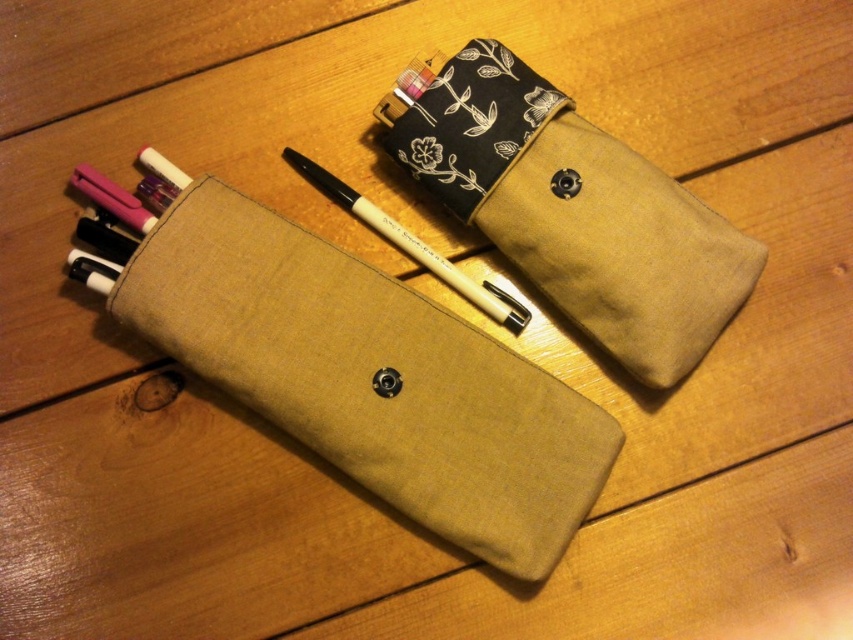
Is the position of canvas pouch at upper center more distant than that of white matte pen at center?

That is False.

Where is `canvas pouch at upper center`? The height and width of the screenshot is (640, 853). canvas pouch at upper center is located at coordinates (573, 211).

Who is more forward, [538,250] or [314,163]?

Point [538,250]

Where is `canvas pouch at upper center`? The width and height of the screenshot is (853, 640). canvas pouch at upper center is located at coordinates (573, 211).

Is point (502, 467) less distant than point (646, 234)?

No, it is behind (646, 234).

Locate an element on the screen. The image size is (853, 640). canvas pouch at center is located at coordinates (370, 378).

Which is more to the left, canvas pouch at center or white matte pen at center?

canvas pouch at center

Is canvas pouch at center above white matte pen at center?

No.

Is point (500, 561) closer to camera compared to point (299, 170)?

Yes, it is.

This screenshot has height=640, width=853. I want to click on canvas pouch at center, so click(x=370, y=378).